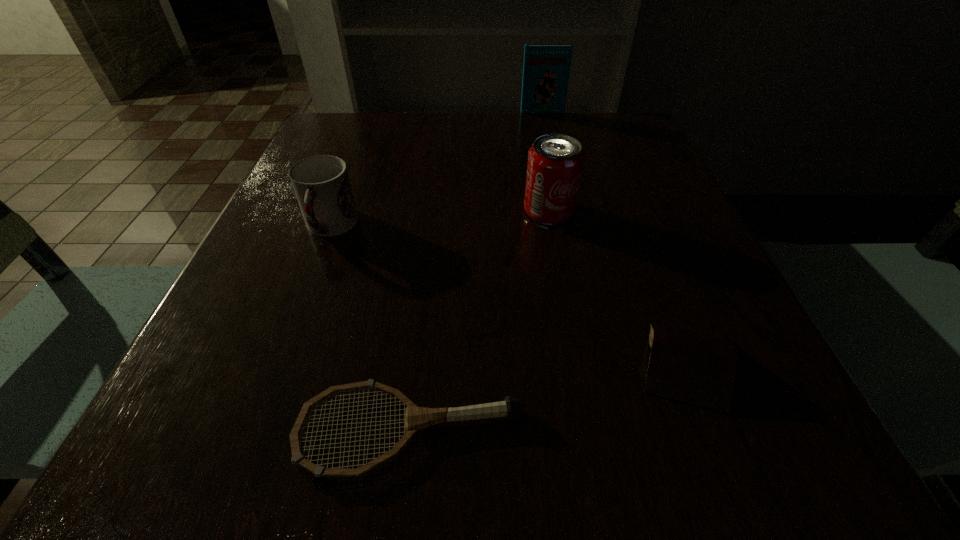
Locate an element on the screen. Image resolution: width=960 pixels, height=540 pixels. the taller book is located at coordinates (546, 69).

At what (x,y) coordinates should I click in order to perform the action: click on the farthest object. Please return your answer as a coordinate pair (x, y). The image size is (960, 540). Looking at the image, I should click on (546, 69).

This screenshot has width=960, height=540. I want to click on can, so click(x=555, y=163).

The height and width of the screenshot is (540, 960). I want to click on the leftmost object, so click(321, 183).

You are a GUI agent. You are given a task and a screenshot of the screen. Output one action in this format:
    pyautogui.click(x=<x>, y=<y>)
    Task: Click on the third tallest object
    The width and height of the screenshot is (960, 540).
    Given the screenshot: What is the action you would take?
    pyautogui.click(x=321, y=183)

The image size is (960, 540). I want to click on the second shortest object, so click(x=688, y=364).

Image resolution: width=960 pixels, height=540 pixels. I want to click on the nearer book, so click(688, 364).

Image resolution: width=960 pixels, height=540 pixels. In order to click on the shortest object in this screenshot , I will do [416, 418].

Find the location of `tennis racket`. tennis racket is located at coordinates (416, 418).

Where is `free location located on the front cover of the taller book`? free location located on the front cover of the taller book is located at coordinates (554, 162).